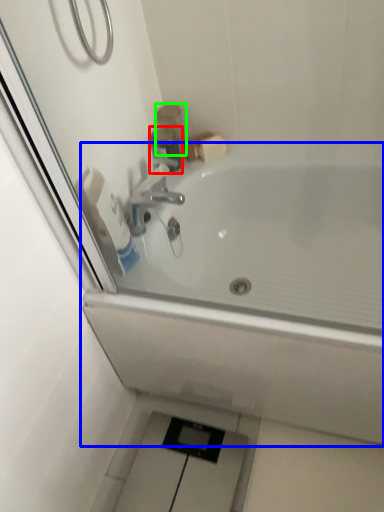
Question: Which is farther away from plumbing fixture (highlighted by a red box)? bathtub (highlighted by a blue box) or toiletry (highlighted by a green box)?

Choices:
 (A) bathtub
 (B) toiletry

Answer: (A)